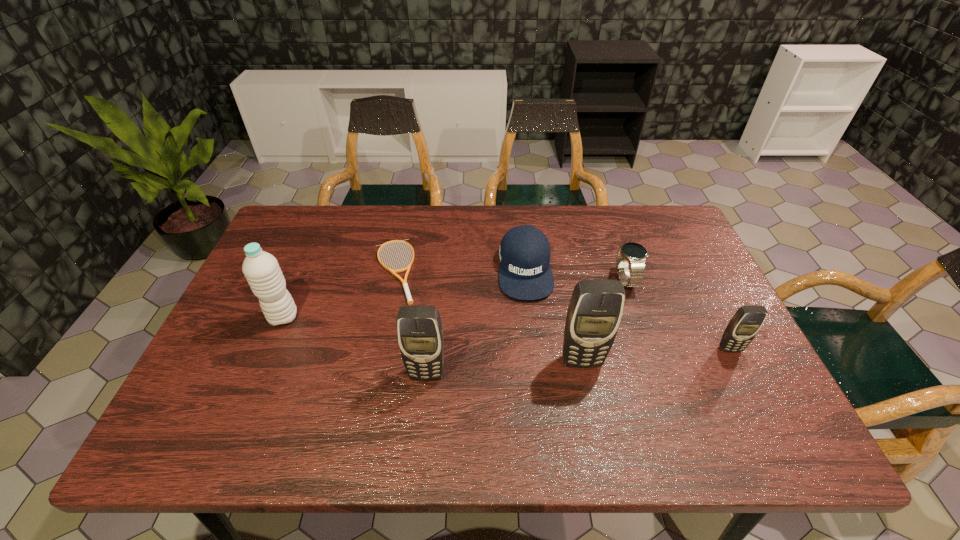
Locate an element on the screen. The height and width of the screenshot is (540, 960). baseball cap is located at coordinates (524, 255).

The width and height of the screenshot is (960, 540). Identify the location of vacant space situated 0.080m on the front face of the second cellular telephone from right to left. (589, 401).

You are a GUI agent. You are given a task and a screenshot of the screen. Output one action in this format:
    pyautogui.click(x=<x>, y=<y>)
    Task: Click on the vacant space located 0.150m on the front face of the fourth tallest object
    
    Given the screenshot: What is the action you would take?
    pyautogui.click(x=761, y=410)

Identify the location of free space located 0.350m on the right of the water bottle. This screenshot has height=540, width=960. (432, 318).

You are a GUI agent. You are given a task and a screenshot of the screen. Output one action in this format:
    pyautogui.click(x=<x>, y=<y>)
    Task: Click on the free space located on the back of the shortest object
    
    Given the screenshot: What is the action you would take?
    pyautogui.click(x=402, y=231)

Where is `vacant space located on the back of the watch`? This screenshot has height=540, width=960. vacant space located on the back of the watch is located at coordinates (602, 212).

Find the location of a particular element. The image size is (960, 540). free space located 0.270m on the front-facing side of the baseball cap is located at coordinates (538, 390).

Find the location of a particular element. The height and width of the screenshot is (540, 960). tennis racket present at the far edge is located at coordinates (404, 282).

Locate an element on the screen. Image resolution: width=960 pixels, height=540 pixels. baseball cap that is at the far edge is located at coordinates coord(524,255).

The image size is (960, 540). I want to click on object present at the near edge, so click(420, 336).